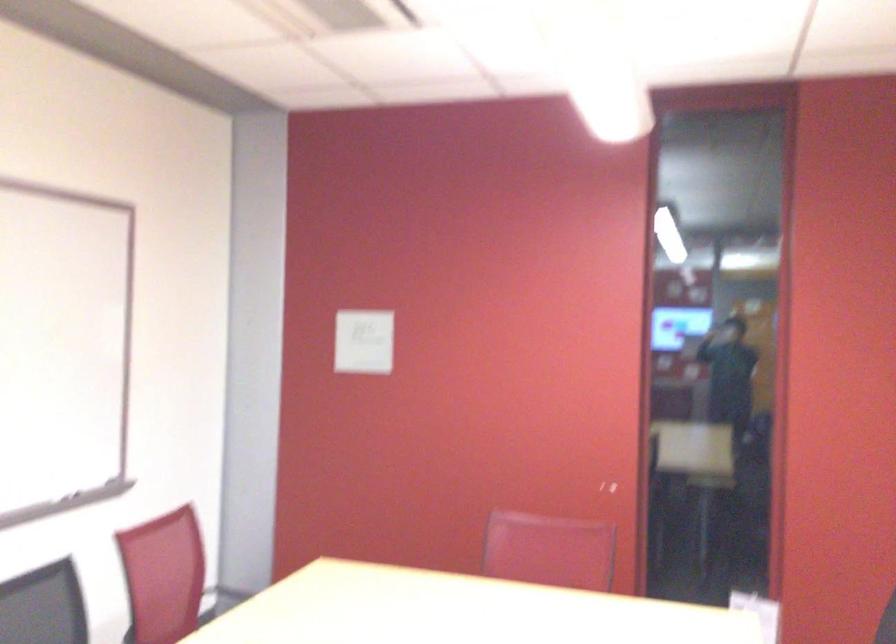
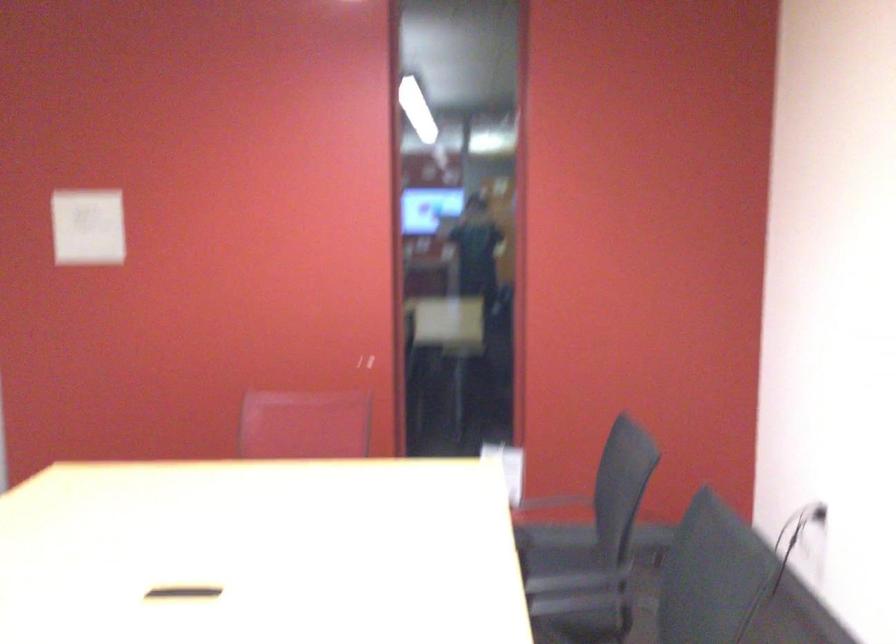
Question: How did the camera likely rotate?

Choices:
 (A) Left
 (B) Right
 (C) Up
 (D) Down

Answer: (B)